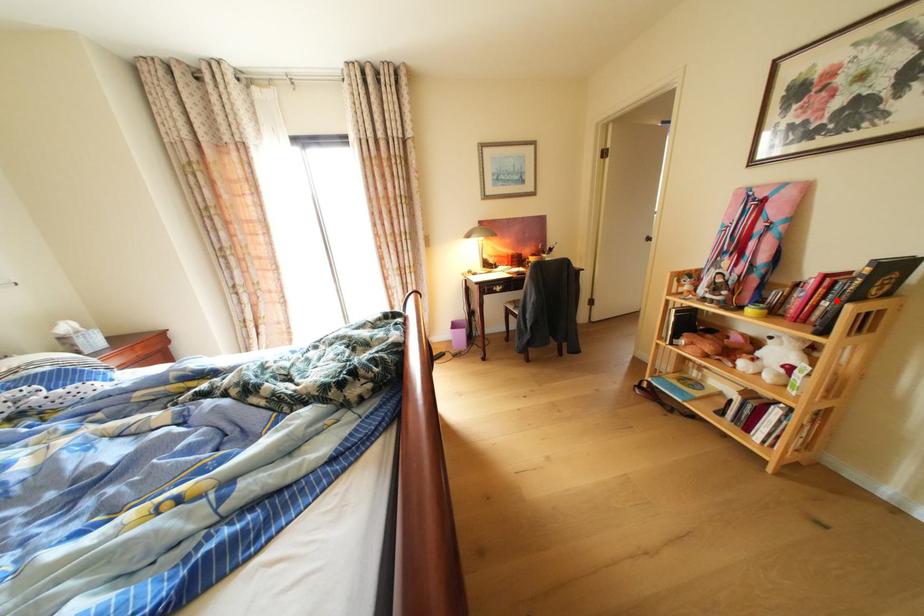
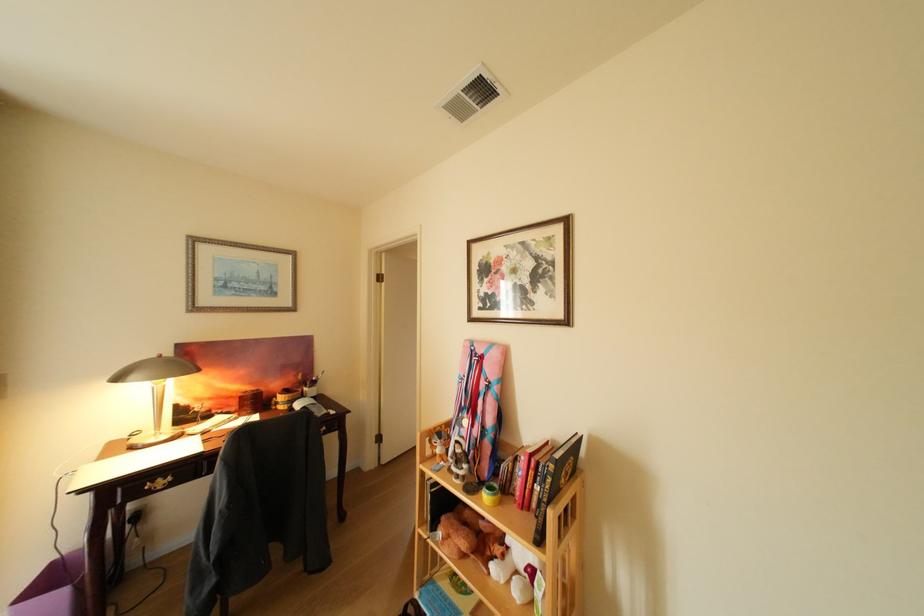
The point at the highlighted location is marked in the first image. Where is the corresponding point in the second image?

(548, 484)